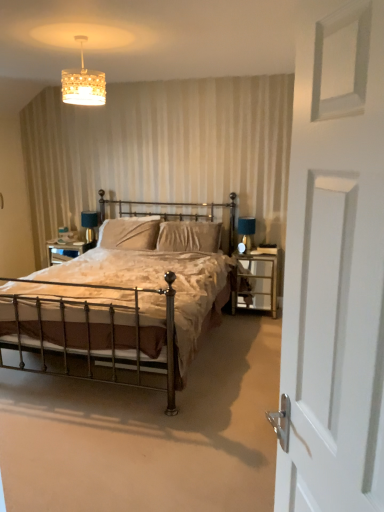
Question: Considering the relative sizes of crystalline glass chandelier at upper center and velvet beige pillow at center, placed as the 1th pillow when sorted from right to left, in the image provided, is crystalline glass chandelier at upper center shorter than velvet beige pillow at center, placed as the 1th pillow when sorted from right to left,?

Choices:
 (A) yes
 (B) no

Answer: (A)

Question: From the image's perspective, is crystalline glass chandelier at upper center beneath velvet beige pillow at center, positioned as the 2th pillow in left-to-right order?

Choices:
 (A) no
 (B) yes

Answer: (A)

Question: Is crystalline glass chandelier at upper center completely or partially outside of velvet beige pillow at center, positioned as the 2th pillow in left-to-right order?

Choices:
 (A) no
 (B) yes

Answer: (B)

Question: Is crystalline glass chandelier at upper center facing away from velvet beige pillow at center, placed as the 1th pillow when sorted from right to left?

Choices:
 (A) no
 (B) yes

Answer: (A)

Question: Does crystalline glass chandelier at upper center appear on the right side of velvet beige pillow at center, placed as the 1th pillow when sorted from right to left?

Choices:
 (A) yes
 (B) no

Answer: (B)

Question: Would you say velvet beige pillow at center, placed as the 1th pillow when sorted from right to left, is to the left or to the right of velvet beige pillow at center, arranged as the first pillow when viewed from the left, in the picture?

Choices:
 (A) right
 (B) left

Answer: (A)

Question: From the image's perspective, is velvet beige pillow at center, positioned as the 2th pillow in left-to-right order, located above or below velvet beige pillow at center, arranged as the first pillow when viewed from the left?

Choices:
 (A) below
 (B) above

Answer: (A)

Question: Is velvet beige pillow at center, placed as the 1th pillow when sorted from right to left, in front of or behind velvet beige pillow at center, arranged as the first pillow when viewed from the left, in the image?

Choices:
 (A) front
 (B) behind

Answer: (A)

Question: Is point pyautogui.click(x=187, y=236) positioned closer to the camera than point pyautogui.click(x=109, y=234)?

Choices:
 (A) farther
 (B) closer

Answer: (B)

Question: Looking at their shapes, would you say white matte door at right is wider or thinner than bronze metal bed at center?

Choices:
 (A) thin
 (B) wide

Answer: (A)

Question: Considering the positions of white matte door at right and bronze metal bed at center in the image, is white matte door at right bigger or smaller than bronze metal bed at center?

Choices:
 (A) big
 (B) small

Answer: (B)

Question: Relative to bronze metal bed at center, is white matte door at right in front or behind?

Choices:
 (A) behind
 (B) front

Answer: (B)

Question: Is white matte door at right spatially inside bronze metal bed at center, or outside of it?

Choices:
 (A) inside
 (B) outside

Answer: (B)

Question: In terms of height, does bronze metal bed at center look taller or shorter compared to metal/glass nightstand at right?

Choices:
 (A) short
 (B) tall

Answer: (B)

Question: From the image's perspective, relative to metal/glass nightstand at right, is bronze metal bed at center above or below?

Choices:
 (A) above
 (B) below

Answer: (A)